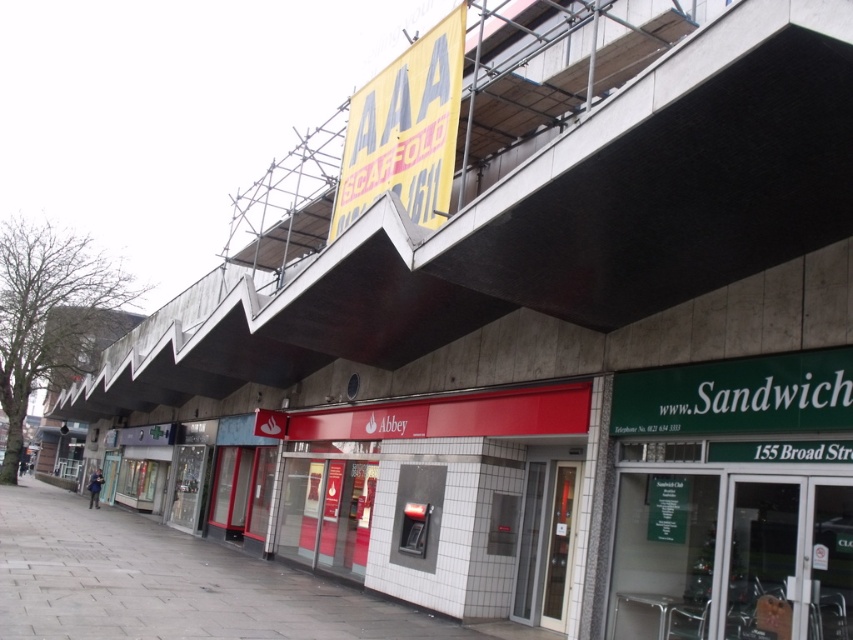
You are a delivery person trying to place a new advertisement on the overhang. The advertisement must be placed where there is enough space. Based on the scene, which object allows for a larger advertisement? Please choose between the concrete at upper center and the yellow paper sign at upper center.

The concrete at upper center has a larger size compared to the yellow paper sign at upper center, so the concrete at upper center allows for a larger advertisement.

You are standing at the point marked by the coordinates point (175,584) on the commercial street. What is the material of the surface you are currently standing on?

The gray concrete pavement at lower left is located at point (175,584), so the material is concrete.